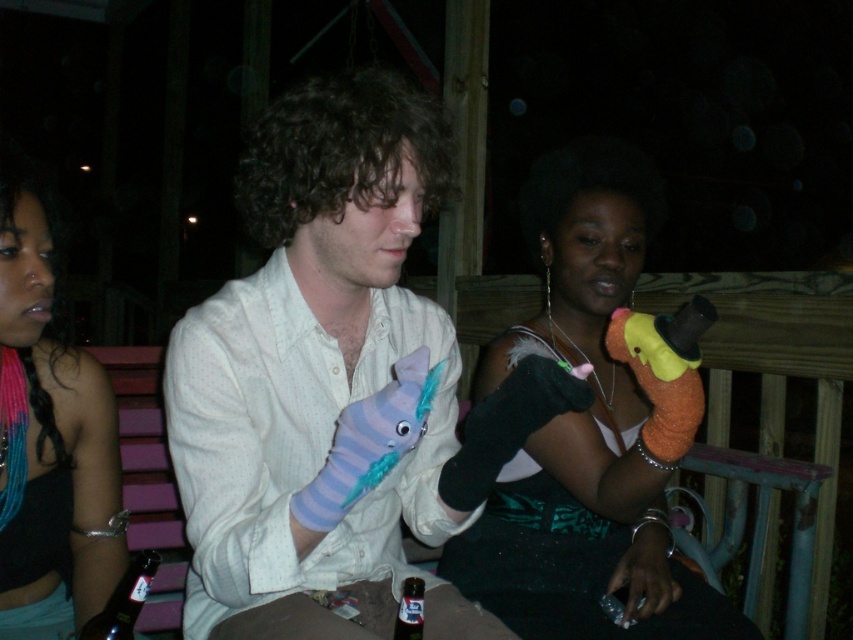
Does orange fuzzy glove at center come behind translucent glass bottle at lower left?

Yes, it is.

Can you confirm if orange fuzzy glove at center is positioned to the left of translucent glass bottle at lower left?

Incorrect, orange fuzzy glove at center is not on the left side of translucent glass bottle at lower left.

The image size is (853, 640). I want to click on orange fuzzy glove at center, so click(593, 428).

Locate an element on the screen. The image size is (853, 640). orange fuzzy glove at center is located at coordinates (593, 428).

Measure the distance between orange fuzzy glove at center and translucent plastic bottle at lower center.

The distance of orange fuzzy glove at center from translucent plastic bottle at lower center is 19.14 inches.

Between point (566, 618) and point (404, 632), which one is positioned in front?

Point (404, 632)

You are a GUI agent. You are given a task and a screenshot of the screen. Output one action in this format:
    pyautogui.click(x=<x>, y=<y>)
    Task: Click on the orange fuzzy glove at center
    Image resolution: width=853 pixels, height=640 pixels.
    Given the screenshot: What is the action you would take?
    pyautogui.click(x=593, y=428)

The image size is (853, 640). In order to click on orange fuzzy glove at center in this screenshot , I will do `click(593, 428)`.

Who is more distant from viewer, [3,483] or [134,582]?

Point [3,483]

Can you confirm if black fabric top at left is positioned below translucent glass bottle at lower left?

Incorrect, black fabric top at left is not positioned below translucent glass bottle at lower left.

Where is `black fabric top at left`? This screenshot has height=640, width=853. black fabric top at left is located at coordinates (49, 438).

Where is `black fabric top at left`? The image size is (853, 640). black fabric top at left is located at coordinates (49, 438).